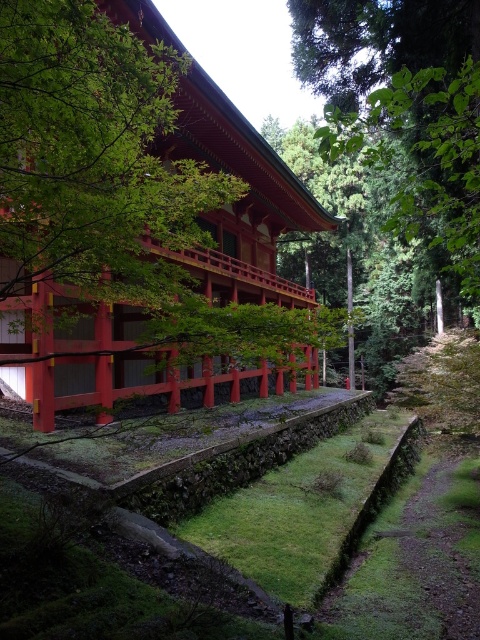
Does green leafy tree at center have a lesser width compared to green leafy tree at upper center?

Yes, green leafy tree at center is thinner than green leafy tree at upper center.

Looking at this image, between green leafy tree at center and green leafy tree at upper center, which one appears on the left side from the viewer's perspective?

Positioned to the left is green leafy tree at center.

Is point (151, 339) positioned in front of point (423, 60)?

Yes, point (151, 339) is in front of point (423, 60).

Find the location of a particular element. Image resolution: width=480 pixels, height=640 pixels. green leafy tree at center is located at coordinates (137, 218).